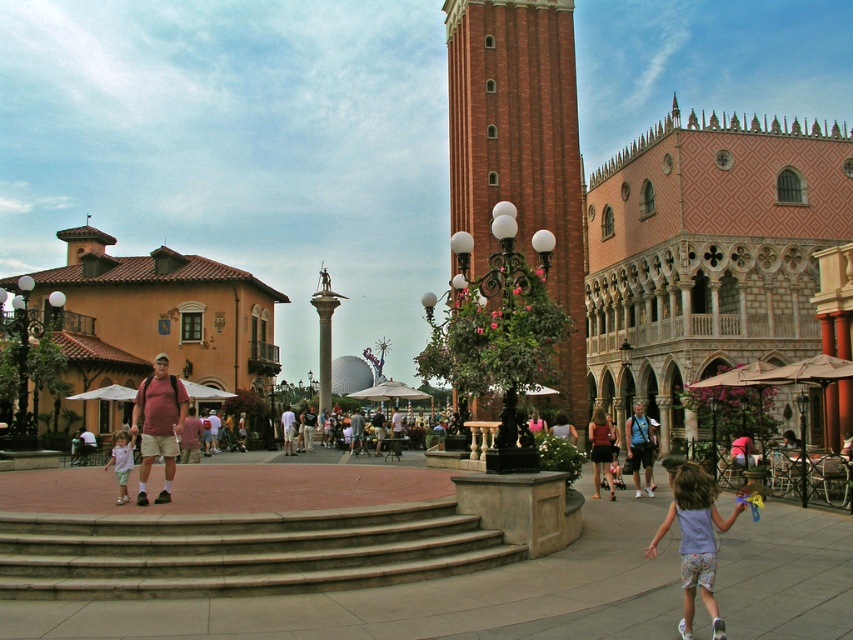
Question: Considering the real-world distances, which object is closest to the matte pink shirt at center?

Choices:
 (A) blue denim shorts at lower right
 (B) light brown leather jacket at center
 (C) matte pink dress at lower right
 (D) brick bell tower at center

Answer: (C)

Question: Is matte pink shirt at center below matte pink dress at lower right?

Choices:
 (A) no
 (B) yes

Answer: (A)

Question: Which object is positioned closest to the matte pink shirt at center?

Choices:
 (A) light brown leather jacket at center
 (B) light pink fabric dress at lower left

Answer: (B)

Question: Estimate the real-world distances between objects in this image. Which object is closer to the light pink fabric dress at lower left?

Choices:
 (A) brick bell tower at center
 (B) blue denim shorts at lower right
 (C) light purple fabric dress at lower right

Answer: (C)

Question: Can you confirm if brick bell tower at center is positioned to the right of light pink fabric dress at lower left?

Choices:
 (A) yes
 (B) no

Answer: (A)

Question: Does light purple fabric dress at lower right appear on the left side of matte pink dress at lower right?

Choices:
 (A) yes
 (B) no

Answer: (A)